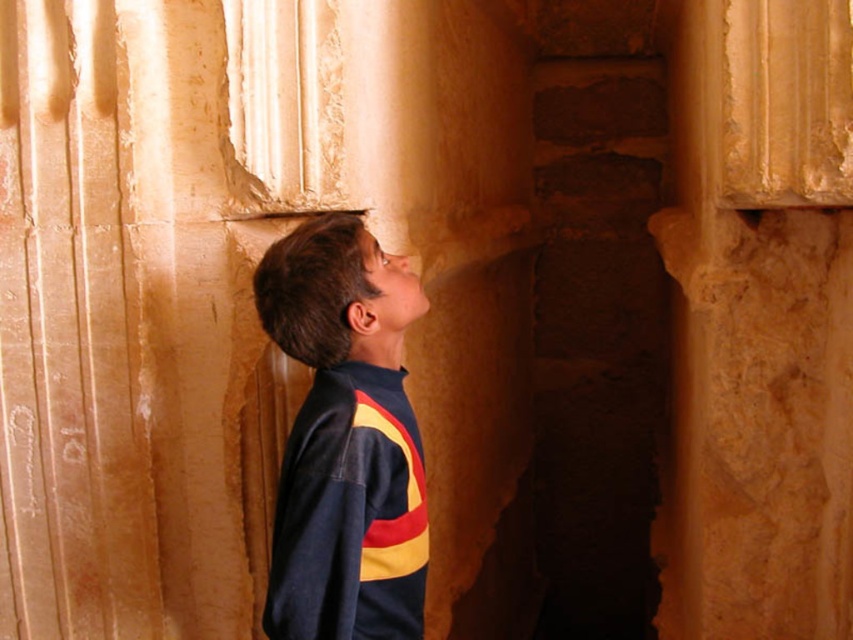
From the picture: You are standing in the same room as the boy and want to touch the smooth stone column at center. Based on its position, where should you look to find it?

The smooth stone column at center is located at point (759, 321), so you should look towards the center of the room and slightly upwards to find it.